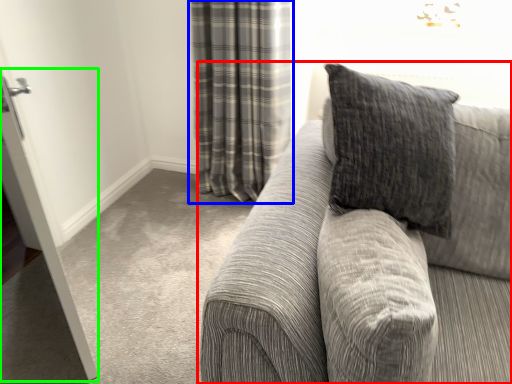
Question: Based on their relative distances, which object is nearer to studio couch (highlighted by a red box)? Choose from curtain (highlighted by a blue box) and screen door (highlighted by a green box).

Choices:
 (A) curtain
 (B) screen door

Answer: (B)